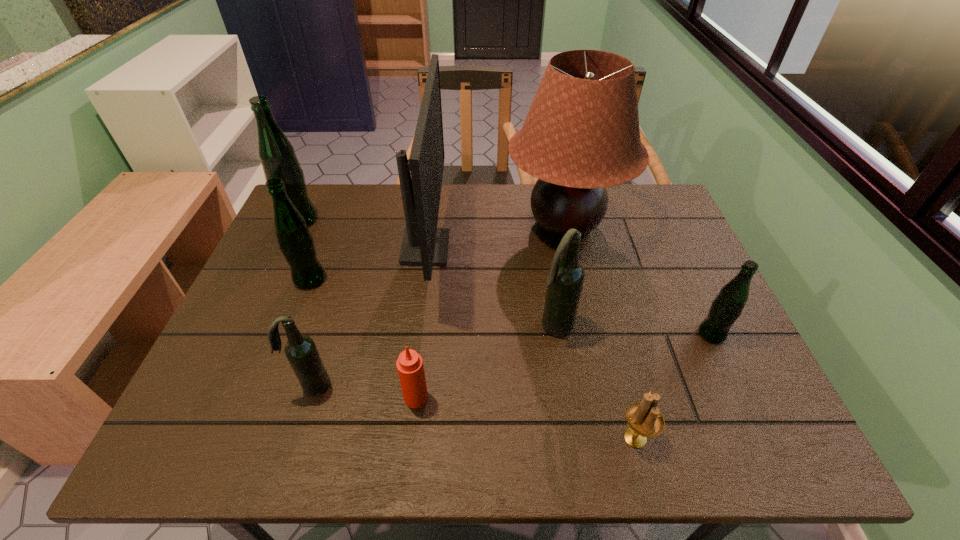
This screenshot has height=540, width=960. Find the location of `lampshade`. lampshade is located at coordinates (581, 134).

The height and width of the screenshot is (540, 960). In order to click on computer monitor in this screenshot , I will do `click(423, 244)`.

Find the location of `the biggest green beer bottle`. the biggest green beer bottle is located at coordinates (277, 155).

Where is `the leftmost green beer bottle`? This screenshot has width=960, height=540. the leftmost green beer bottle is located at coordinates (277, 155).

Where is `the bigger dark beer bottle`? The width and height of the screenshot is (960, 540). the bigger dark beer bottle is located at coordinates (566, 277).

Locate an element on the screen. This screenshot has height=540, width=960. the right dark beer bottle is located at coordinates (566, 277).

Image resolution: width=960 pixels, height=540 pixels. In order to click on the second object from left to right in this screenshot , I will do `click(296, 243)`.

What are the coordinates of `the second beer bottle from left to right` in the screenshot? It's located at (296, 243).

Locate an element on the screen. The image size is (960, 540). the rightmost green beer bottle is located at coordinates (726, 308).

Locate an element on the screen. the rightmost beer bottle is located at coordinates (726, 308).